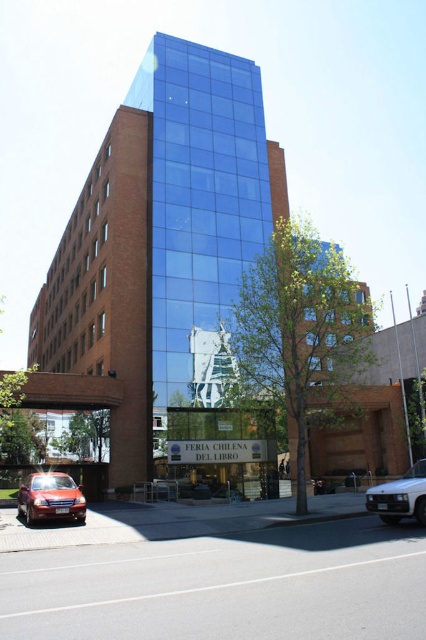
Between shiny red sedan at lower left and white matte car at lower right, which one appears on the right side from the viewer's perspective?

white matte car at lower right

Is point (52, 492) positioned after point (371, 508)?

Yes.

This screenshot has height=640, width=426. In order to click on shiny red sedan at lower left in this screenshot , I will do `click(51, 499)`.